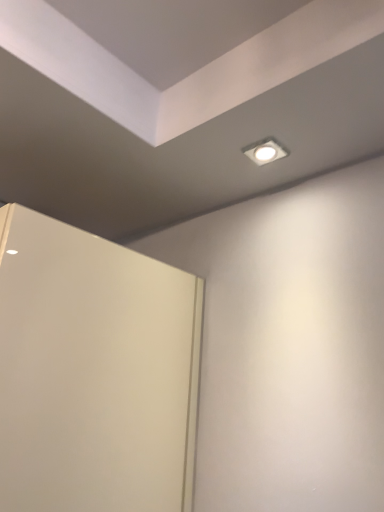
Question: Choose the correct answer: Is white glossy square light at upper center inside white matte door at left or outside it?

Choices:
 (A) outside
 (B) inside

Answer: (A)

Question: From a real-world perspective, is white glossy square light at upper center above or below white matte door at left?

Choices:
 (A) above
 (B) below

Answer: (A)

Question: Considering the positions of point pyautogui.click(x=259, y=157) and point pyautogui.click(x=46, y=355), is point pyautogui.click(x=259, y=157) closer or farther from the camera than point pyautogui.click(x=46, y=355)?

Choices:
 (A) farther
 (B) closer

Answer: (A)

Question: From a real-world perspective, is white matte door at left positioned above or below white glossy square light at upper center?

Choices:
 (A) above
 (B) below

Answer: (B)

Question: Is white matte door at left inside the boundaries of white glossy square light at upper center, or outside?

Choices:
 (A) inside
 (B) outside

Answer: (B)

Question: Is point (33, 490) positioned closer to the camera than point (269, 157)?

Choices:
 (A) closer
 (B) farther

Answer: (A)

Question: In terms of width, does white matte door at left look wider or thinner when compared to white glossy square light at upper center?

Choices:
 (A) thin
 (B) wide

Answer: (A)